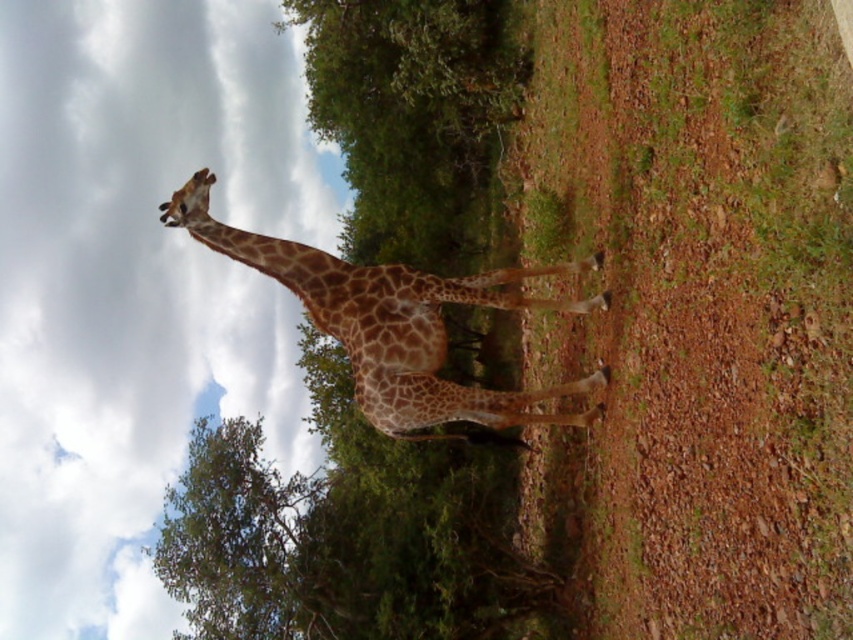
Question: Which point is farther to the camera?

Choices:
 (A) (457, 412)
 (B) (352, 234)

Answer: (B)

Question: Which of the following is the farthest from the observer?

Choices:
 (A) spotted fur giraffe at center
 (B) brown textured grass at center

Answer: (A)

Question: Is brown textured grass at center to the left of spotted fur giraffe at center from the viewer's perspective?

Choices:
 (A) yes
 (B) no

Answer: (B)

Question: Does brown textured grass at center have a larger size compared to spotted fur giraffe at center?

Choices:
 (A) no
 (B) yes

Answer: (B)

Question: Which object appears farthest from the camera in this image?

Choices:
 (A) spotted fur giraffe at center
 (B) brown textured grass at center

Answer: (A)

Question: Is brown textured grass at center positioned at the back of spotted fur giraffe at center?

Choices:
 (A) yes
 (B) no

Answer: (B)